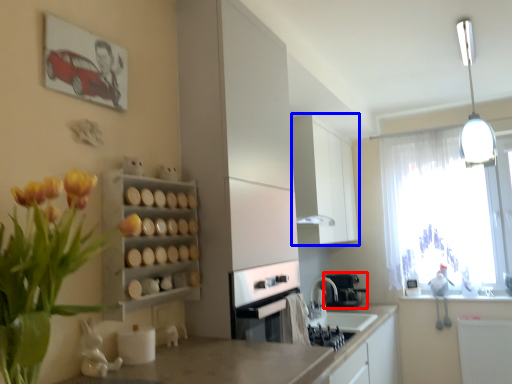
Question: Among these objects, which one is nearest to the camera, coffee machine (highlighted by a red box) or cabinetry (highlighted by a blue box)?

Choices:
 (A) coffee machine
 (B) cabinetry

Answer: (B)